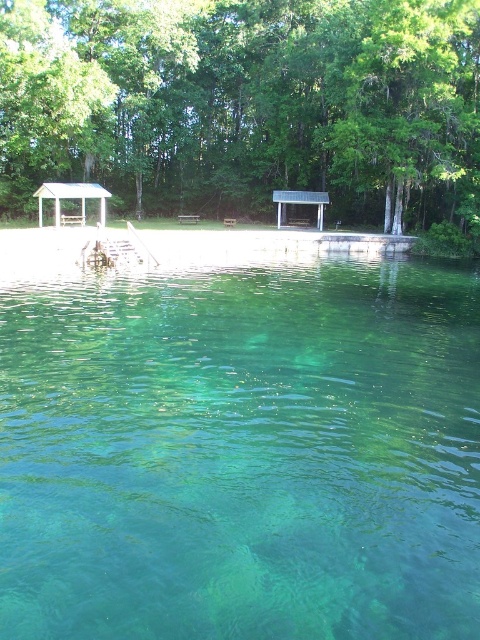
Question: Is clear water at center below green leafy tree at center?

Choices:
 (A) yes
 (B) no

Answer: (A)

Question: Is white wooden gazebo at left bigger than wooden picnic table at center?

Choices:
 (A) yes
 (B) no

Answer: (A)

Question: Which point is farther from the camera taking this photo?

Choices:
 (A) (151, 252)
 (B) (184, 216)
 (C) (295, 200)
 (D) (427, 112)

Answer: (B)

Question: Which object is closer to the camera taking this photo?

Choices:
 (A) green leafy tree at center
 (B) wooden picnic table at center
 (C) wooden dock at center

Answer: (C)

Question: Estimate the real-world distances between objects in this image. Which object is closer to the clear water at center?

Choices:
 (A) wooden park bench at center
 (B) wooden dock at center
 (C) wooden picnic table at center

Answer: (B)

Question: Can you confirm if clear water at center is wider than green leafy tree at center?

Choices:
 (A) yes
 (B) no

Answer: (B)